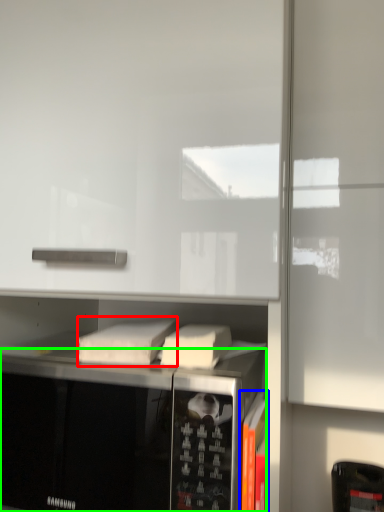
Question: Based on their relative distances, which object is farther from book (highlighted by a red box)? Choose from book (highlighted by a blue box) and microwave oven (highlighted by a green box).

Choices:
 (A) book
 (B) microwave oven

Answer: (A)